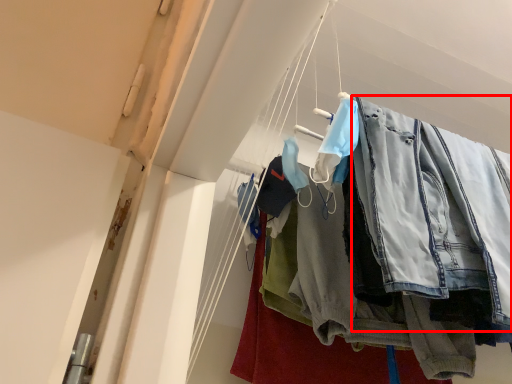
Question: From the image's perspective, where is clothing (annotated by the red box) located relative to trousers?

Choices:
 (A) above
 (B) below

Answer: (A)